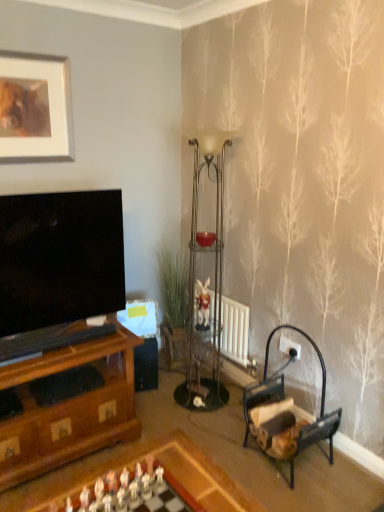
You are a GUI agent. You are given a task and a screenshot of the screen. Output one action in this format:
    pyautogui.click(x=<x>, y=<y>)
    Task: Click on the free space in front of wooden armchair at lower right
    This screenshot has width=384, height=512.
    Given the screenshot: What is the action you would take?
    pyautogui.click(x=303, y=495)